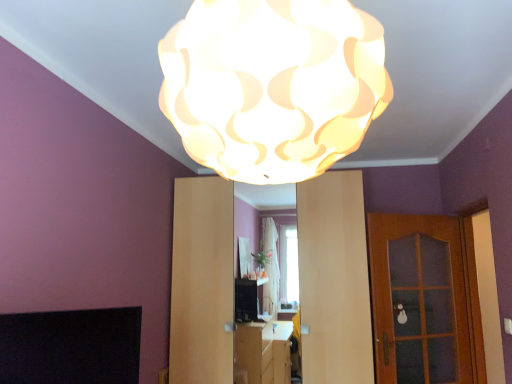
Question: Should I look upward or downward to see white matte lampshade at upper center?

Choices:
 (A) down
 (B) up

Answer: (B)

Question: Is matte wood dresser at center outside wooden glass door at right?

Choices:
 (A) no
 (B) yes

Answer: (B)

Question: Is matte wood dresser at center oriented towards wooden glass door at right?

Choices:
 (A) yes
 (B) no

Answer: (B)

Question: Is matte wood dresser at center thinner than wooden glass door at right?

Choices:
 (A) no
 (B) yes

Answer: (A)

Question: Can you confirm if matte wood dresser at center is taller than wooden glass door at right?

Choices:
 (A) yes
 (B) no

Answer: (A)

Question: Does matte wood dresser at center appear on the right side of wooden glass door at right?

Choices:
 (A) no
 (B) yes

Answer: (A)

Question: Is matte wood dresser at center bigger than wooden glass door at right?

Choices:
 (A) no
 (B) yes

Answer: (B)

Question: Is wooden glass door at right not inside matte wood dresser at center?

Choices:
 (A) no
 (B) yes

Answer: (B)

Question: Does wooden glass door at right have a lesser width compared to matte wood dresser at center?

Choices:
 (A) yes
 (B) no

Answer: (A)

Question: Does wooden glass door at right lie behind matte wood dresser at center?

Choices:
 (A) no
 (B) yes

Answer: (B)

Question: Are wooden glass door at right and matte wood dresser at center located far from each other?

Choices:
 (A) no
 (B) yes

Answer: (B)

Question: Can you confirm if wooden glass door at right is bigger than matte wood dresser at center?

Choices:
 (A) yes
 (B) no

Answer: (B)

Question: Is wooden glass door at right to the right of matte wood dresser at center from the viewer's perspective?

Choices:
 (A) yes
 (B) no

Answer: (A)

Question: Does wooden glass door at right appear on the left side of white matte lampshade at upper center?

Choices:
 (A) yes
 (B) no

Answer: (B)